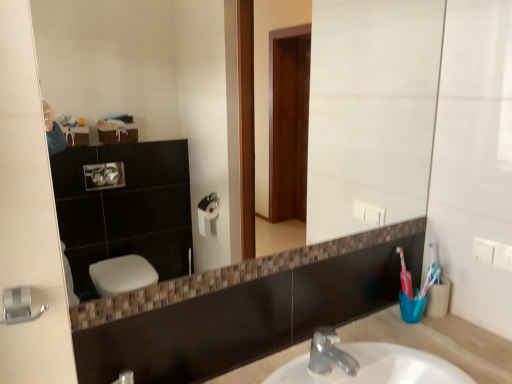
Question: From a real-world perspective, is beige marble sink at center physically located above or below matte glass mirror at center?

Choices:
 (A) below
 (B) above

Answer: (A)

Question: Is point (358, 334) closer or farther from the camera than point (407, 56)?

Choices:
 (A) farther
 (B) closer

Answer: (B)

Question: Is beige marble sink at center bigger or smaller than matte glass mirror at center?

Choices:
 (A) big
 (B) small

Answer: (B)

Question: From the image's perspective, is matte glass mirror at center located above or below beige marble sink at center?

Choices:
 (A) below
 (B) above

Answer: (B)

Question: Based on their sizes in the image, would you say matte glass mirror at center is bigger or smaller than beige marble sink at center?

Choices:
 (A) small
 (B) big

Answer: (B)

Question: Considering the positions of point (205, 127) and point (473, 357), is point (205, 127) closer or farther from the camera than point (473, 357)?

Choices:
 (A) closer
 (B) farther

Answer: (A)

Question: Relative to beige marble sink at center, is matte glass mirror at center in front or behind?

Choices:
 (A) behind
 (B) front

Answer: (B)